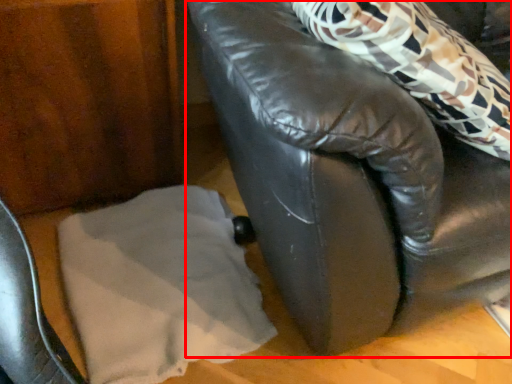
Question: In this image, where is furniture (annotated by the red box) located relative to linen?

Choices:
 (A) right
 (B) left

Answer: (A)